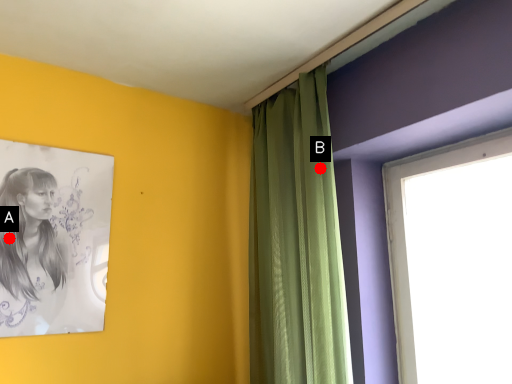
Question: Two points are circled on the image, labeled by A and B beside each circle. Among these points, which one is farthest from the camera?

Choices:
 (A) A is further
 (B) B is further

Answer: (B)